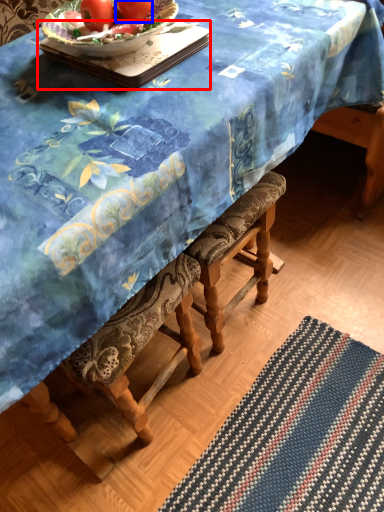
Question: Which object is further to the camera taking this photo, tray (highlighted by a red box) or tomato (highlighted by a blue box)?

Choices:
 (A) tray
 (B) tomato

Answer: (B)